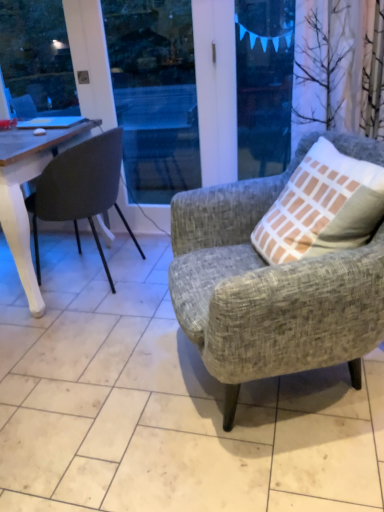
Question: Should I look upward or downward to see textured gray armchair at right, marked as the 2th chair in a back-to-front arrangement?

Choices:
 (A) up
 (B) down

Answer: (B)

Question: From a real-world perspective, does matte black chair at left, arranged as the second chair when viewed from the front, stand above transparent plastic window screen at upper center?

Choices:
 (A) no
 (B) yes

Answer: (A)

Question: Considering the relative positions of matte black chair at left, arranged as the second chair when viewed from the front, and transparent plastic window screen at upper center in the image provided, is matte black chair at left, arranged as the second chair when viewed from the front, to the left of transparent plastic window screen at upper center from the viewer's perspective?

Choices:
 (A) yes
 (B) no

Answer: (A)

Question: Is matte black chair at left, positioned as the 2th chair in right-to-left order, turned away from transparent plastic window screen at upper center?

Choices:
 (A) yes
 (B) no

Answer: (B)

Question: Are matte black chair at left, positioned as the 2th chair in right-to-left order, and transparent plastic window screen at upper center far apart?

Choices:
 (A) yes
 (B) no

Answer: (B)

Question: Considering the relative sizes of matte black chair at left, the 1th chair when ordered from back to front, and transparent plastic window screen at upper center in the image provided, is matte black chair at left, the 1th chair when ordered from back to front, wider than transparent plastic window screen at upper center?

Choices:
 (A) yes
 (B) no

Answer: (A)

Question: Is matte black chair at left, arranged as the second chair when viewed from the front, directly adjacent to transparent plastic window screen at upper center?

Choices:
 (A) yes
 (B) no

Answer: (B)

Question: Is the position of textured gray armchair at right, acting as the 1th chair starting from the right, more distant than that of transparent plastic window screen at upper center?

Choices:
 (A) no
 (B) yes

Answer: (A)

Question: Is textured gray armchair at right, marked as the 2th chair in a back-to-front arrangement, smaller than transparent plastic window screen at upper center?

Choices:
 (A) no
 (B) yes

Answer: (A)

Question: Is textured gray armchair at right, marked as the 2th chair in a back-to-front arrangement, to the right of transparent plastic window screen at upper center from the viewer's perspective?

Choices:
 (A) no
 (B) yes

Answer: (A)

Question: Does textured gray armchair at right, which appears as the first chair when viewed from the front, lie in front of transparent plastic window screen at upper center?

Choices:
 (A) yes
 (B) no

Answer: (A)

Question: Are textured gray armchair at right, marked as the 2th chair in a back-to-front arrangement, and transparent plastic window screen at upper center beside each other?

Choices:
 (A) no
 (B) yes

Answer: (A)

Question: Is textured gray armchair at right, the second chair viewed from the left, oriented towards transparent plastic window screen at upper center?

Choices:
 (A) yes
 (B) no

Answer: (B)

Question: Is transparent plastic window screen at upper center oriented away from textured gray armchair at right, which appears as the first chair when viewed from the front?

Choices:
 (A) no
 (B) yes

Answer: (A)